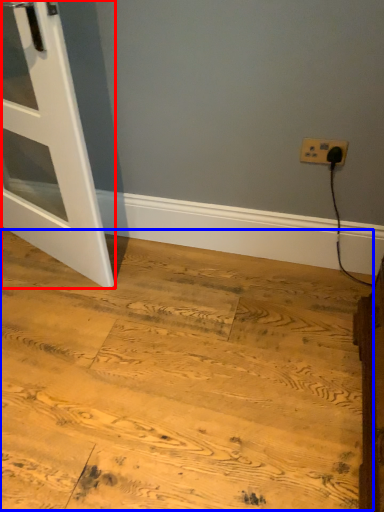
Question: Which of the following is the farthest to the observer, door (highlighted by a red box) or plywood (highlighted by a blue box)?

Choices:
 (A) door
 (B) plywood

Answer: (A)